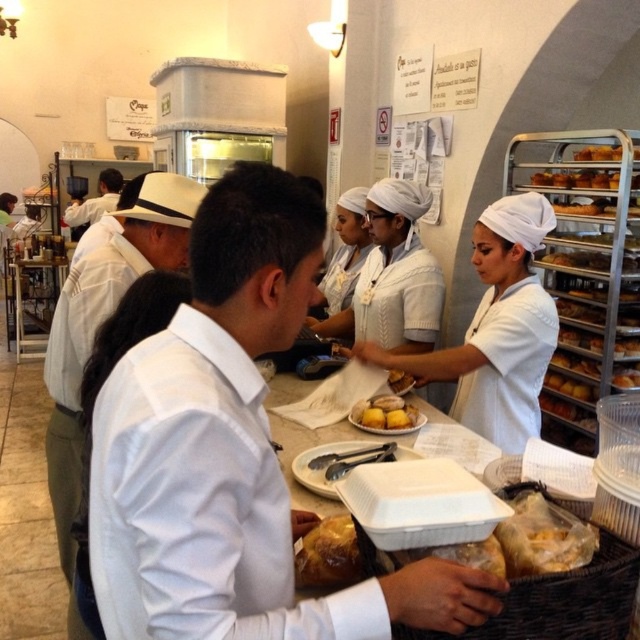
Question: Which object is farther from the camera taking this photo?

Choices:
 (A) translucent plastic bag at lower right
 (B) yellow matte cake at center
 (C) white matte shirt at center
 (D) yellow matte bread at center

Answer: (B)

Question: Which point appears farthest from the camera in this image?

Choices:
 (A) (124, 214)
 (B) (413, 632)

Answer: (A)

Question: Does white matte shirt at center appear on the right side of translucent plastic bag at lower right?

Choices:
 (A) no
 (B) yes

Answer: (A)

Question: Considering the relative positions of yellow matte bread at center and white uniform shirt at center in the image provided, where is yellow matte bread at center located with respect to white uniform shirt at center?

Choices:
 (A) above
 (B) below

Answer: (B)

Question: Which object appears farthest from the camera in this image?

Choices:
 (A) white matte shirt at center
 (B) yellow matte cake at center
 (C) white knit sweater at center

Answer: (B)

Question: Does translucent plastic bag at lower right have a greater width compared to yellow matte bread at center?

Choices:
 (A) no
 (B) yes

Answer: (A)